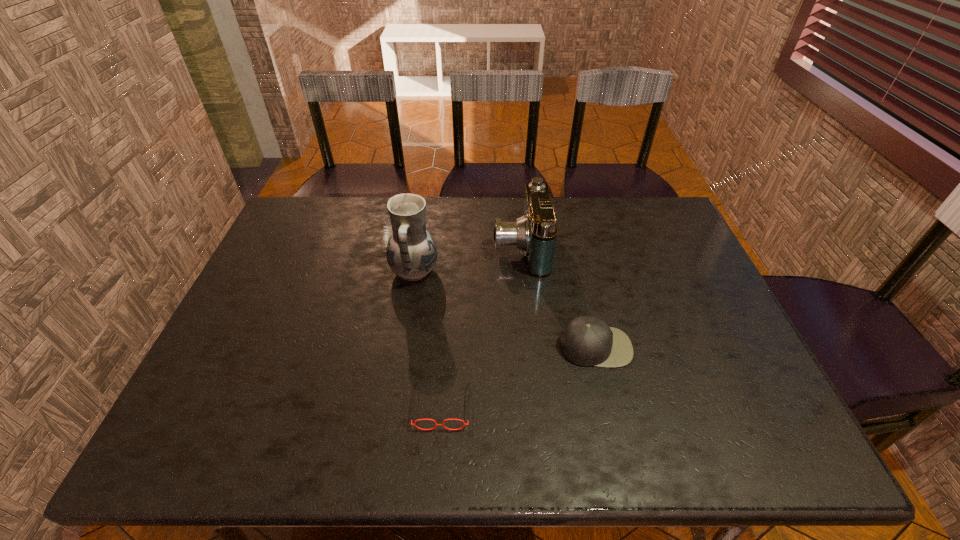
Locate an element on the screen. The width and height of the screenshot is (960, 540). free point between the tallest object and the nearest object is located at coordinates (428, 339).

At what (x,y) coordinates should I click in order to perform the action: click on vacant space that is in between the third tallest object and the tallest object. Please return your answer as a coordinate pair (x, y). This screenshot has height=540, width=960. Looking at the image, I should click on (505, 309).

The image size is (960, 540). What are the coordinates of `empty space between the camcorder and the third tallest object` in the screenshot? It's located at (558, 296).

You are a GUI agent. You are given a task and a screenshot of the screen. Output one action in this format:
    pyautogui.click(x=<x>, y=<y>)
    Task: Click on the vacant region between the third farthest object and the camcorder
    
    Given the screenshot: What is the action you would take?
    pyautogui.click(x=558, y=296)

Identify the location of blank region between the nearest object and the second shortest object. The width and height of the screenshot is (960, 540). (518, 376).

Image resolution: width=960 pixels, height=540 pixels. In order to click on vacant area that lies between the tallest object and the second shortest object in this screenshot , I will do `click(505, 309)`.

Where is `free spot between the pitcher and the cap`? This screenshot has height=540, width=960. free spot between the pitcher and the cap is located at coordinates (505, 309).

The image size is (960, 540). Find the location of `free spot between the second shortest object and the camcorder`. free spot between the second shortest object and the camcorder is located at coordinates (558, 296).

Locate which object is the third closest to the nearest object. Please provide its 2D coordinates. Your answer should be formatted as a tuple, i.e. [(x, y)], where the tuple contains the x and y coordinates of a point satisfying the conditions above.

[(535, 233)]

Select which object is the third closest to the third shortest object. Please provide its 2D coordinates. Your answer should be formatted as a tuple, i.e. [(x, y)], where the tuple contains the x and y coordinates of a point satisfying the conditions above.

[(436, 424)]